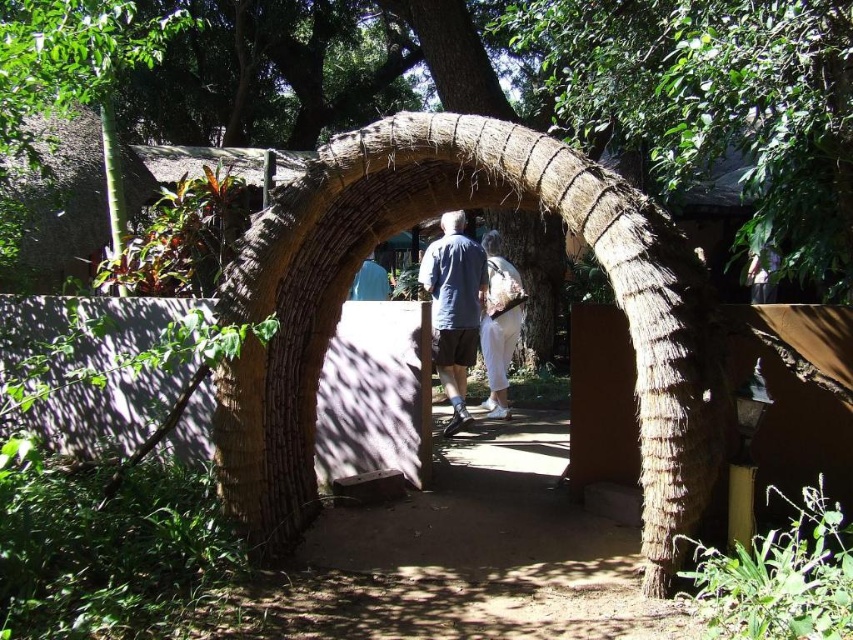
Consider the image. You are standing at the entrance of the rustic palm leaf archway and want to place two decorative lights at the coordinates point (485, 266) and point (508, 324). Which point is closer to you so the light can be more visible?

Point (485, 266) is closer to the viewer than point (508, 324), so placing the decorative light there would make it more visible.

You are planning to hang a light blue fabric decoration in the center of a rustic natural setting with a large natural thatched arch. Based on the scene description, will the light blue fabric at center be smaller or larger than the natural thatched arch at center?

The natural thatched arch at center has a larger size compared to light blue fabric at center, so the light blue fabric at center will be smaller than the natural thatched arch at center.